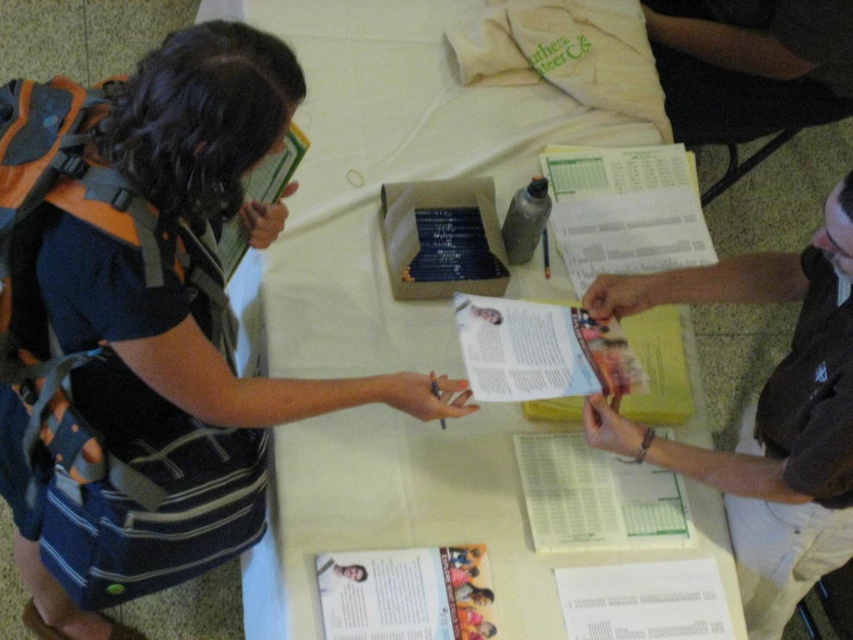
You are a photographer standing at the camera position. You need to take a photo of the scene without including the matte black backpack at left. What should you do?

Move the camera closer to the scene because the matte black backpack at left is 36.69 inches away from the camera. By moving closer, you can frame the shot to exclude the backpack while still capturing the rest of the scene.

You are organizing a booth and need to place the white paper at center and the dark brown leather wallet at center on the table. According to the scene, which item is placed on top of the other?

The white paper at center is positioned over the dark brown leather wallet at center, so the white paper is on top.

You are organizing a small event and need to place a sign on the table between the matte black backpack at left and the dark brown leather wallet at center. The sign must be placed exactly halfway between them. Can you determine if there is enough space between the two items to fit the sign, which is 10 cm wide?

The matte black backpack at left might be wider than the dark brown leather wallet at center, so we cannot determine the exact distance between them. Therefore, it is uncertain if the 10 cm wide sign can fit in the space between them.